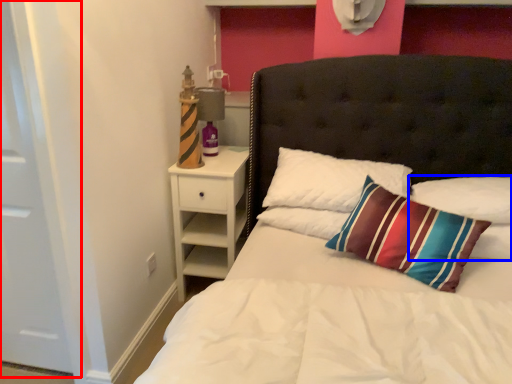
Question: Which point is closer to the camera, door (highlighted by a red box) or pillow (highlighted by a blue box)?

Choices:
 (A) door
 (B) pillow

Answer: (A)